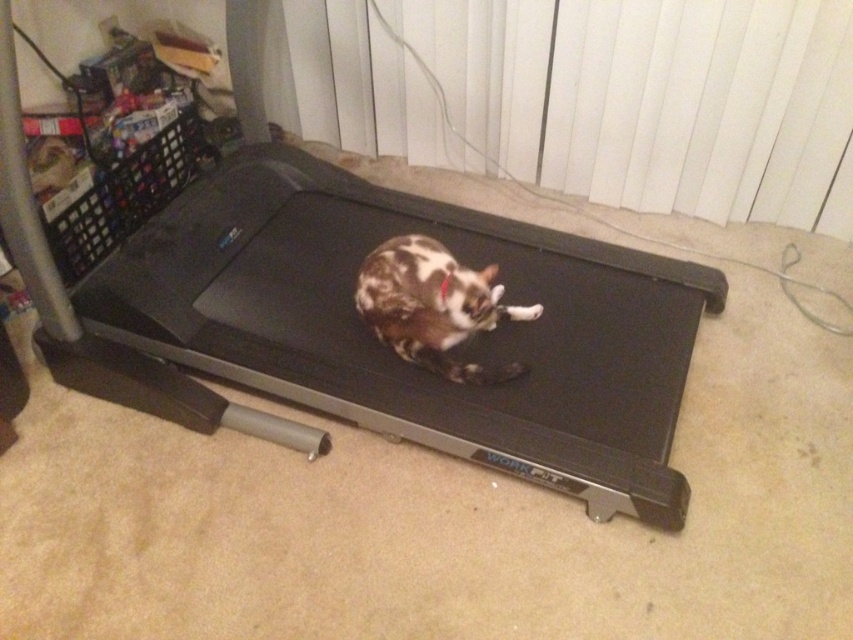
Question: Does black rubber treadmill at center come in front of brown spotted fur cat at center?

Choices:
 (A) yes
 (B) no

Answer: (A)

Question: Which of the following is the closest to the observer?

Choices:
 (A) (244, 344)
 (B) (401, 298)

Answer: (B)

Question: Is black rubber treadmill at center bigger than brown spotted fur cat at center?

Choices:
 (A) yes
 (B) no

Answer: (A)

Question: Can you confirm if black rubber treadmill at center is positioned below brown spotted fur cat at center?

Choices:
 (A) no
 (B) yes

Answer: (A)